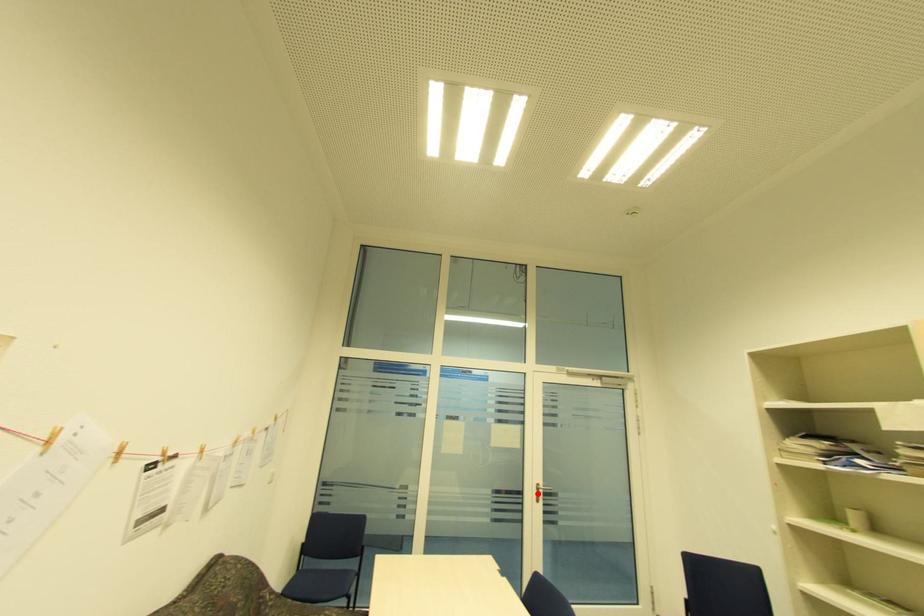
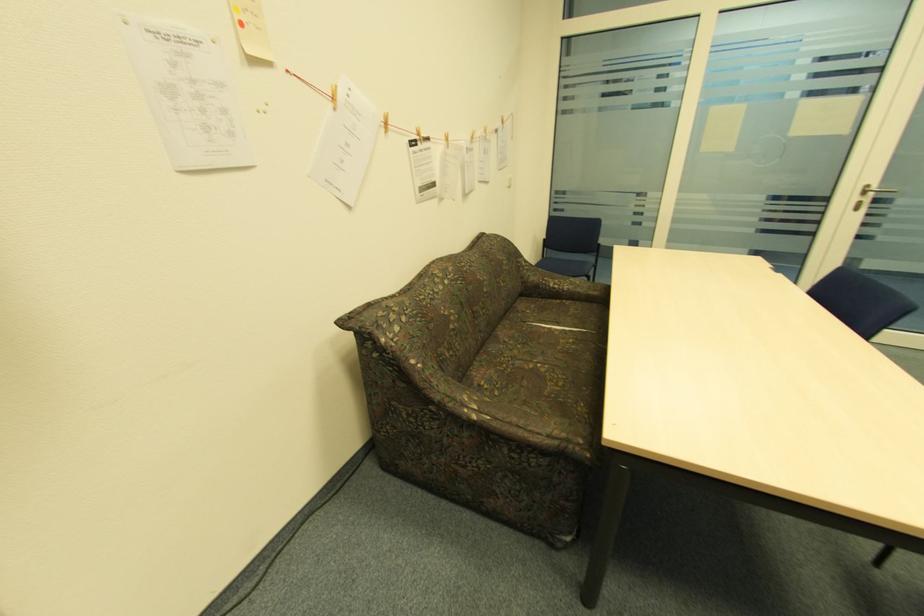
In the second image, find the point that corresponds to the highlighted location in the first image.

(859, 199)